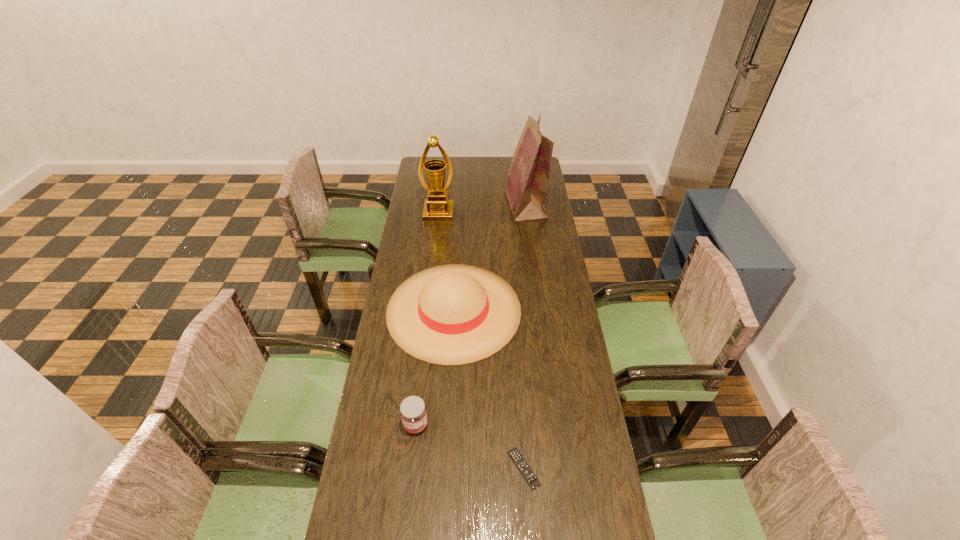
Where is `vacant space at the left edge of the desktop`? The image size is (960, 540). vacant space at the left edge of the desktop is located at coordinates (392, 480).

In the image, there is a desktop. Identify the location of blank space at the right edge. This screenshot has height=540, width=960. (541, 241).

The width and height of the screenshot is (960, 540). Find the location of `free space between the remote control and the third farthest object`. free space between the remote control and the third farthest object is located at coordinates (489, 389).

Where is `free space between the award and the sombrero`? The image size is (960, 540). free space between the award and the sombrero is located at coordinates (446, 261).

Where is `vacant area that lies between the shortest object and the second nearest object`? vacant area that lies between the shortest object and the second nearest object is located at coordinates (469, 447).

Identify the location of unoccupied position between the grocery bag and the award. Image resolution: width=960 pixels, height=540 pixels. (482, 209).

Find the location of a particular element. free point between the shortest object and the grocery bag is located at coordinates (525, 336).

Find the location of a particular element. free space between the third shortest object and the fourth tallest object is located at coordinates (435, 367).

Find the location of a particular element. Image resolution: width=960 pixels, height=540 pixels. vacant region between the second nearest object and the nearest object is located at coordinates (469, 447).

Where is `blank region between the third tallest object and the award`? blank region between the third tallest object and the award is located at coordinates (446, 261).